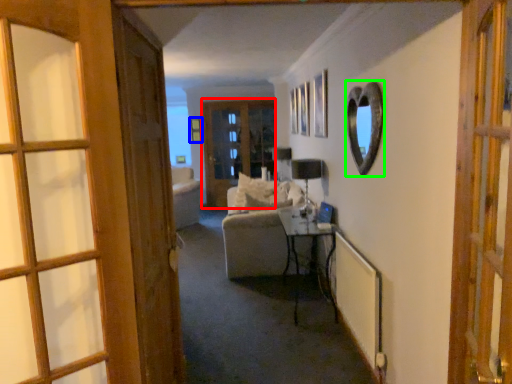
Question: Which is nearer to the door (highlighted by a red box)? picture frame (highlighted by a blue box) or mirror (highlighted by a green box).

Choices:
 (A) picture frame
 (B) mirror

Answer: (A)